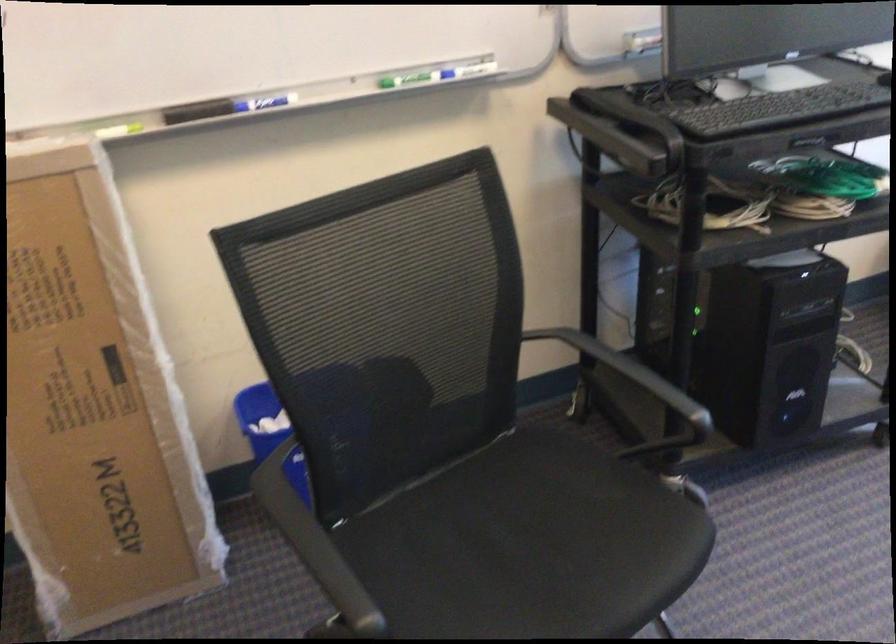
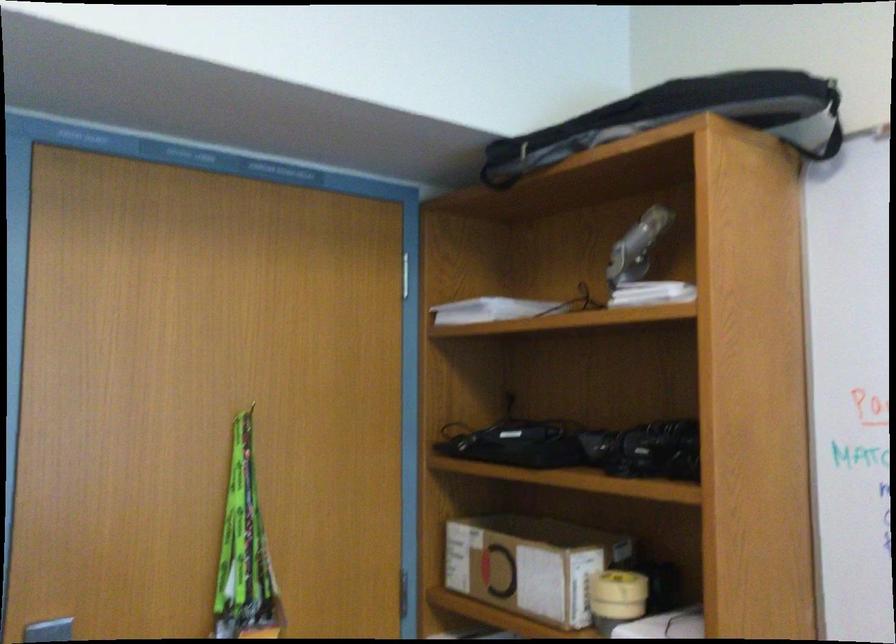
Question: How did the camera likely rotate?

Choices:
 (A) Left
 (B) Right
 (C) Up
 (D) Down

Answer: (A)